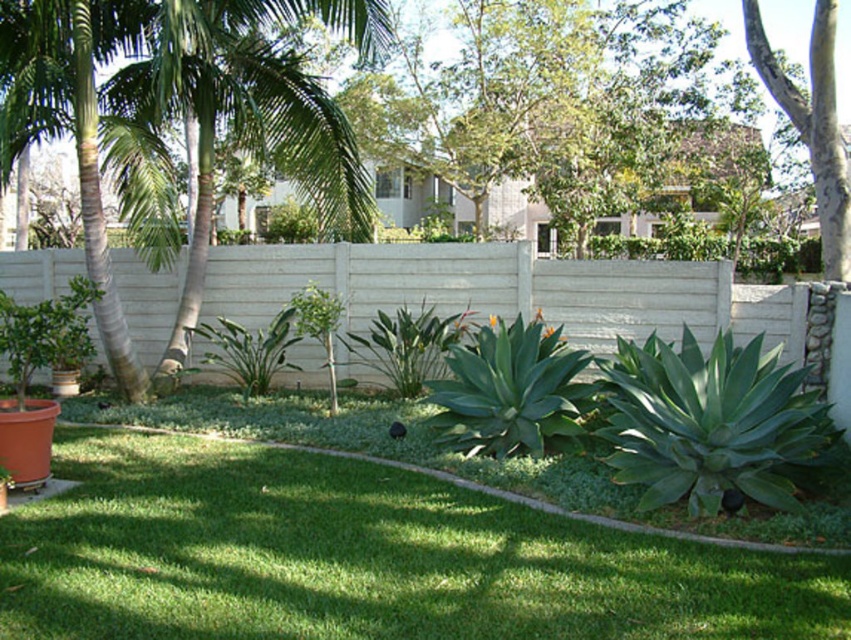
Looking at this image, you are a gardener who wants to water the green grass at center and the smooth gray bark tree at upper right. Which one should you water first if you want to start from the closest to you?

The green grass at center is in front of the smooth gray bark tree at upper right, so you should water the green grass at center first since it is closer to you.